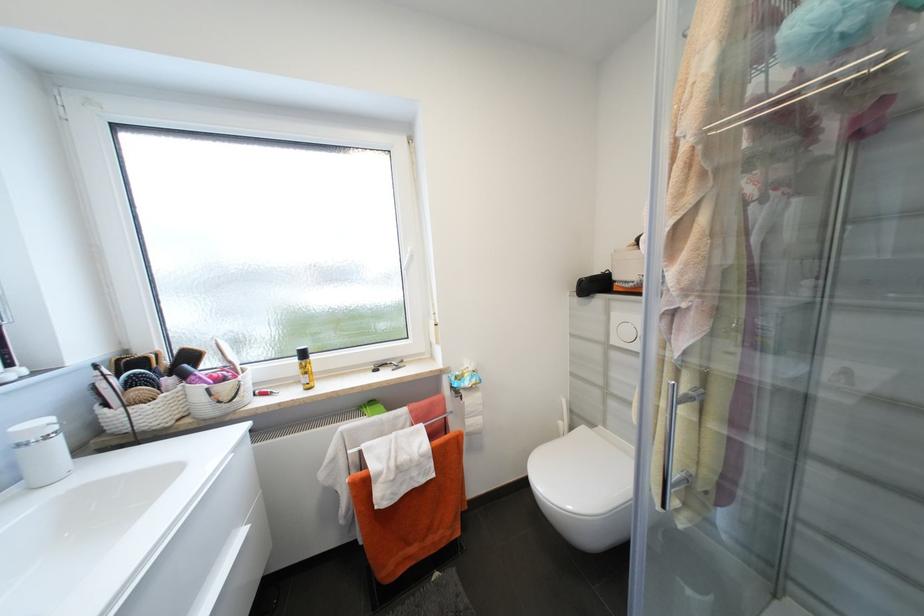
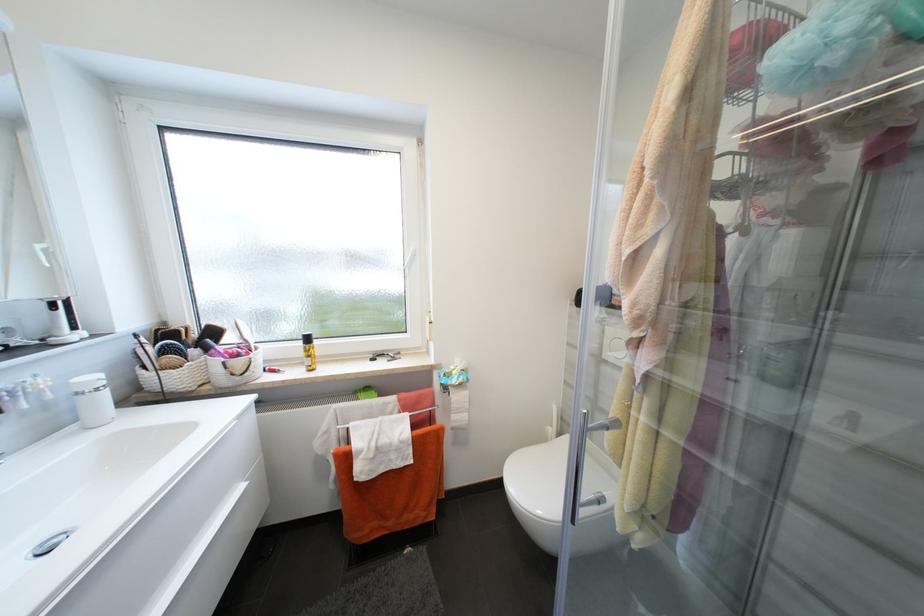
Question: The camera is either moving clockwise (left) or counter-clockwise (right) around the object. The first image is from the beginning of the video and the second image is from the end. Is the camera moving left or right when shooting the video?

Choices:
 (A) Left
 (B) Right

Answer: (B)